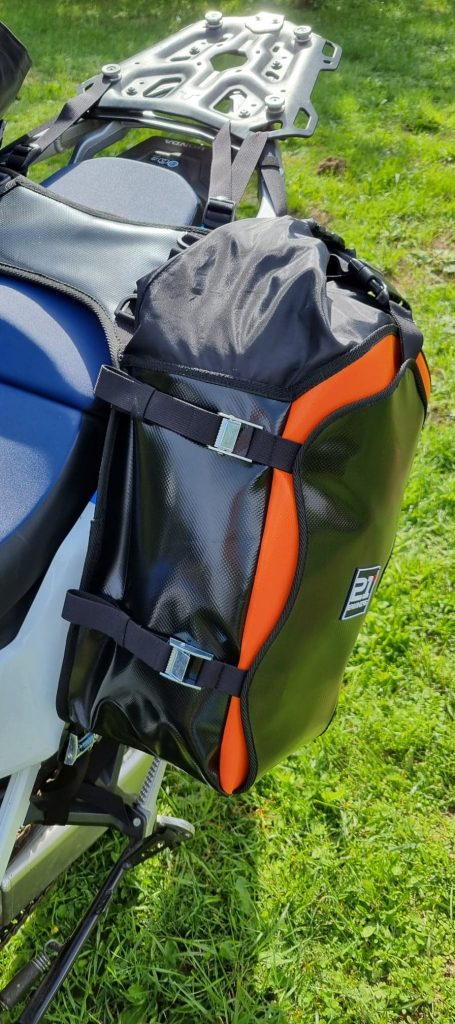
Identify the location of seat. (39, 443).